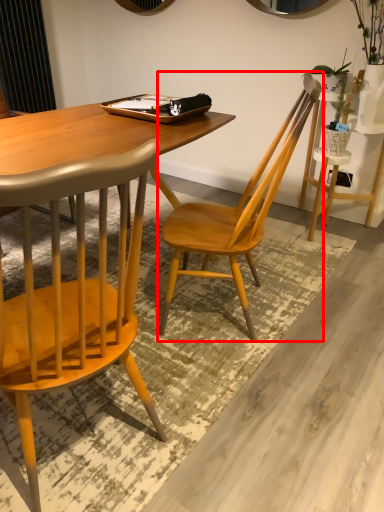
Question: From the image's perspective, what is the correct spatial relationship of chair (annotated by the red box) in relation to chair?

Choices:
 (A) below
 (B) above

Answer: (B)